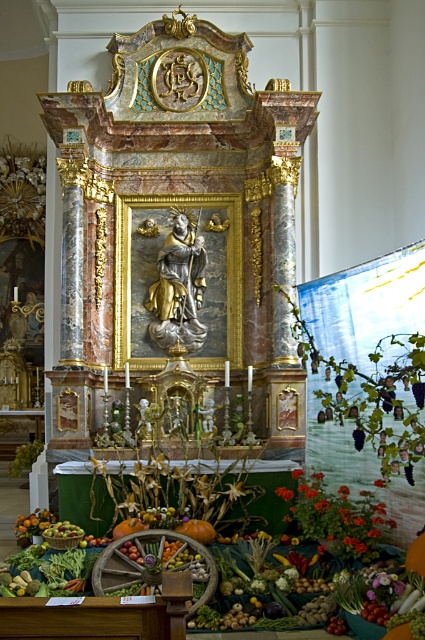
Question: Considering the real-world distances, which object is closest to the smooth orange pumpkin at center?

Choices:
 (A) gold plated statue at center
 (B) smooth pumpkin at center
 (C) green matte apples at lower center

Answer: (B)

Question: Which point is closer to the camera?

Choices:
 (A) orange matte flower at center
 (B) vibrant orange petals at center
 (C) smooth orange fruit at lower left

Answer: (B)

Question: Does gold plated statue at center have a larger size compared to smooth orange fruit at lower left?

Choices:
 (A) yes
 (B) no

Answer: (A)

Question: Observing the image, what is the correct spatial positioning of smooth orange fruit at lower left in reference to orange matte flower at center?

Choices:
 (A) below
 (B) above

Answer: (A)

Question: Which object is the farthest from the orange matte flower at center?

Choices:
 (A) smooth orange pumpkin at center
 (B) smooth pumpkin at center
 (C) gold plated statue at center

Answer: (C)

Question: Is vibrant orange petals at center further to camera compared to smooth orange fruit at lower left?

Choices:
 (A) yes
 (B) no

Answer: (B)